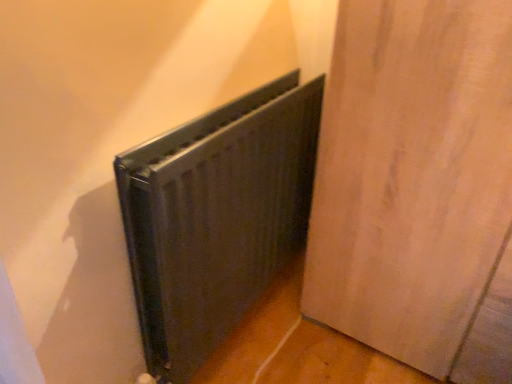
Identify the location of black matte radiator at center. (216, 217).

This screenshot has height=384, width=512. What do you see at coordinates (216, 217) in the screenshot? I see `black matte radiator at center` at bounding box center [216, 217].

Image resolution: width=512 pixels, height=384 pixels. What do you see at coordinates (412, 175) in the screenshot? I see `matte wood door at center` at bounding box center [412, 175].

This screenshot has height=384, width=512. What are the coordinates of `matte wood door at center` in the screenshot? It's located at (412, 175).

In order to face matte wood door at center, should I rotate leftwards or rightwards?

To face it directly, rotate right by 23.981 degrees.

You are a GUI agent. You are given a task and a screenshot of the screen. Output one action in this format:
    pyautogui.click(x=<x>, y=<y>)
    Task: Click on the black matte radiator at center
    This screenshot has width=512, height=384.
    Given the screenshot: What is the action you would take?
    pyautogui.click(x=216, y=217)

In the image, is black matte radiator at center on the left side or the right side of matte wood door at center?

black matte radiator at center is to the left of matte wood door at center.

Between black matte radiator at center and matte wood door at center, which one is positioned in front?

matte wood door at center.

Which is behind, point (213, 174) or point (385, 126)?

Point (385, 126)

From the image's perspective, is black matte radiator at center positioned above or below matte wood door at center?

black matte radiator at center is situated lower than matte wood door at center in the image.

From a real-world perspective, does black matte radiator at center sit lower than matte wood door at center?

Yes, from a real-world perspective, black matte radiator at center is below matte wood door at center.

Can you confirm if black matte radiator at center is thinner than matte wood door at center?

Indeed, black matte radiator at center has a lesser width compared to matte wood door at center.

Who is taller, black matte radiator at center or matte wood door at center?

With more height is matte wood door at center.

Can you confirm if black matte radiator at center is smaller than matte wood door at center?

Indeed, black matte radiator at center has a smaller size compared to matte wood door at center.

Is matte wood door at center completely or partially inside black matte radiator at center?

No, matte wood door at center is not inside black matte radiator at center.

Is black matte radiator at center far away from matte wood door at center?

That's not correct — black matte radiator at center is a little close to matte wood door at center.

Is black matte radiator at center turned away from matte wood door at center?

No, black matte radiator at center is not facing away from matte wood door at center.

What's the angular difference between black matte radiator at center and matte wood door at center's facing directions?

The facing directions of black matte radiator at center and matte wood door at center are 90.3 degrees apart.

At what (x,y) coordinates should I click in order to perform the action: click on radiator below the matte wood door at center (from a real-world perspective). Please return your answer as a coordinate pair (x, y). Looking at the image, I should click on (216, 217).

Is matte wood door at center to the right of black matte radiator at center from the viewer's perspective?

Yes.

Is matte wood door at center in front of or behind black matte radiator at center in the image?

In the image, matte wood door at center appears in front of black matte radiator at center.

Considering the points (412, 262) and (167, 298), which point is in front, point (412, 262) or point (167, 298)?

The point (167, 298) is closer.

From the image's perspective, is matte wood door at center over black matte radiator at center?

Indeed, from the image's perspective, matte wood door at center is shown above black matte radiator at center.

Looking at this image, from a real-world perspective, who is located higher, matte wood door at center or black matte radiator at center?

matte wood door at center, from a real-world perspective.

Is matte wood door at center thinner than black matte radiator at center?

No.

Between matte wood door at center and black matte radiator at center, which one has more height?

matte wood door at center.

Based on their sizes in the image, would you say matte wood door at center is bigger or smaller than black matte radiator at center?

Considering their sizes, matte wood door at center takes up more space than black matte radiator at center.

Which is correct: matte wood door at center is inside black matte radiator at center, or outside of it?

matte wood door at center is spatially situated outside black matte radiator at center.

From the picture: Can you see matte wood door at center touching black matte radiator at center?

No, matte wood door at center is not in contact with black matte radiator at center.

Could you tell me if matte wood door at center is turned towards black matte radiator at center?

No.

In the image, there is a matte wood door at center. In order to click on radiator below it (from a real-world perspective) in this screenshot , I will do `click(216, 217)`.

Where is `radiator behind the matte wood door at center`? The height and width of the screenshot is (384, 512). radiator behind the matte wood door at center is located at coordinates click(216, 217).

You are a GUI agent. You are given a task and a screenshot of the screen. Output one action in this format:
    pyautogui.click(x=<x>, y=<y>)
    Task: Click on the door on the right of the black matte radiator at center
    Image resolution: width=512 pixels, height=384 pixels.
    Given the screenshot: What is the action you would take?
    pyautogui.click(x=412, y=175)